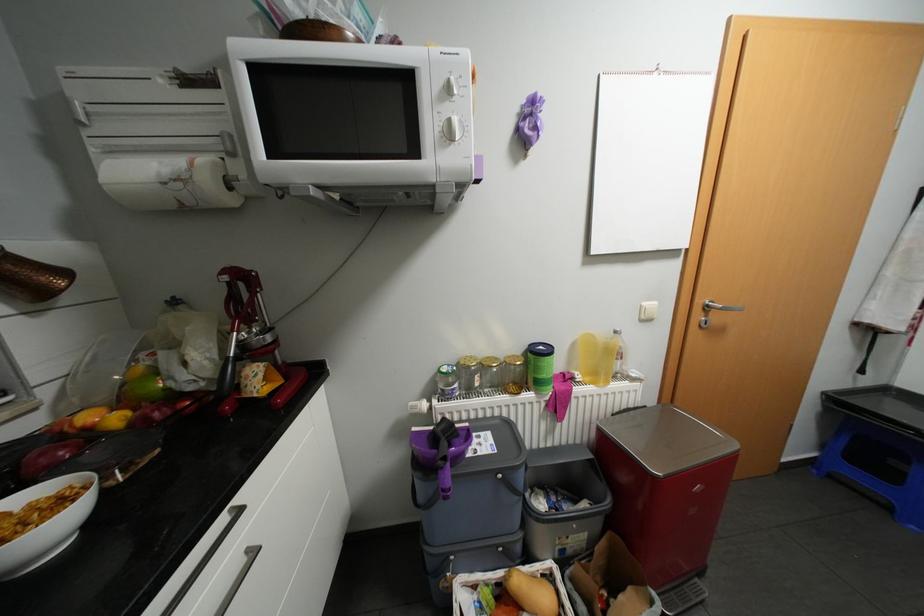
The location [621,359] corresponds to which object?

It corresponds to the plastic water bottle in the image.